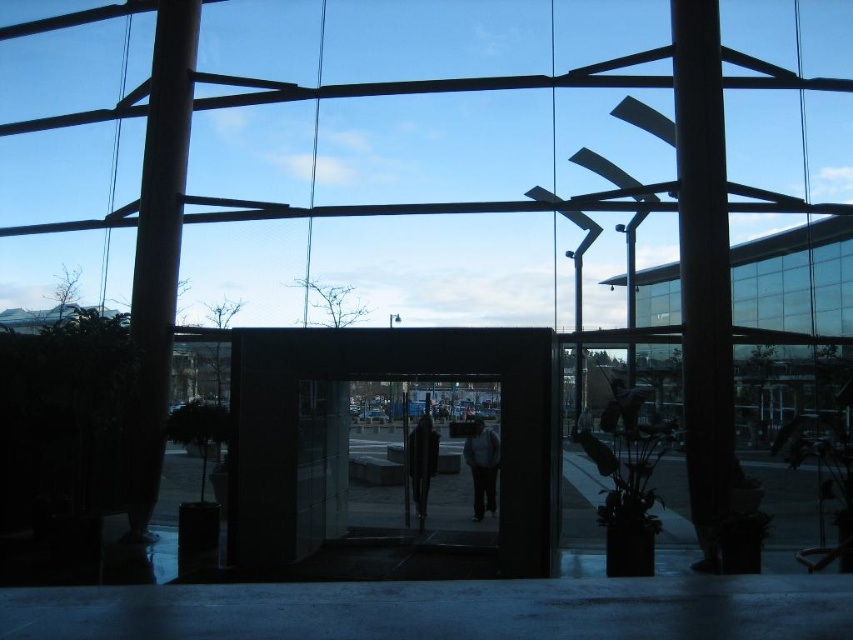
Describe the element at coordinates (160, 244) in the screenshot. Image resolution: width=853 pixels, height=640 pixels. I see `matte glass pillar at left` at that location.

Does matte glass pillar at left have a larger size compared to dark gray sweater at center?

Indeed, matte glass pillar at left has a larger size compared to dark gray sweater at center.

Is point (154, 305) in front of point (495, 451)?

Yes, point (154, 305) is closer to viewer.

Where is `matte glass pillar at left`? The width and height of the screenshot is (853, 640). matte glass pillar at left is located at coordinates (160, 244).

Who is more distant from viewer, (712, 170) or (167, 166)?

The point (167, 166) is behind.

You are a GUI agent. You are given a task and a screenshot of the screen. Output one action in this format:
    pyautogui.click(x=<x>, y=<y>)
    Task: Click on the smooth dark brown wooden pillar at right
    
    Given the screenshot: What is the action you would take?
    pyautogui.click(x=703, y=269)

Between point (705, 109) and point (183, 122), which one is positioned in front?

Point (705, 109)

Where is `smooth dark brown wooden pillar at right`? smooth dark brown wooden pillar at right is located at coordinates (703, 269).

Is dark gray sweater at center wider than dark gray coat at center?

Indeed, dark gray sweater at center has a greater width compared to dark gray coat at center.

What do you see at coordinates (482, 467) in the screenshot? I see `dark gray sweater at center` at bounding box center [482, 467].

Image resolution: width=853 pixels, height=640 pixels. What do you see at coordinates (482, 467) in the screenshot? I see `dark gray sweater at center` at bounding box center [482, 467].

Where is `dark gray sweater at center`? This screenshot has width=853, height=640. dark gray sweater at center is located at coordinates (482, 467).